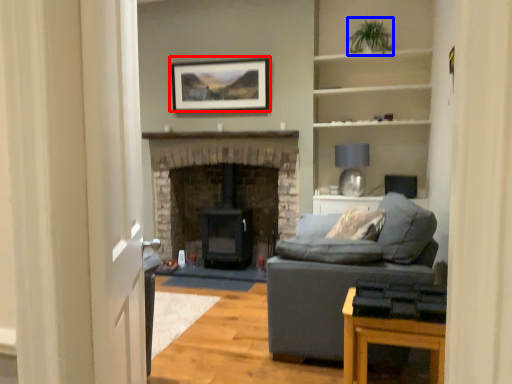
Question: Which object appears closest to the camera in this image, picture frame (highlighted by a red box) or plant (highlighted by a blue box)?

Choices:
 (A) picture frame
 (B) plant

Answer: (B)